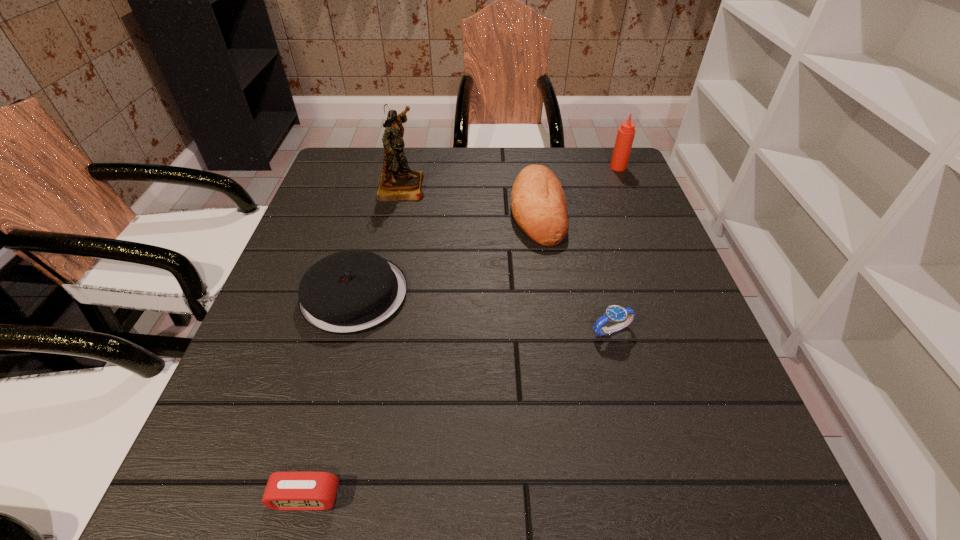
Choose which object is the second nearest neighbor to the tallest object. Please provide its 2D coordinates. Your answer should be formatted as a tuple, i.e. [(x, y)], where the tuple contains the x and y coordinates of a point satisfying the conditions above.

[(539, 207)]

Identify the location of vacant area that satisfies the following two spatial constraints: 1. on the front-facing side of the tallest object; 2. on the left side of the bread. (396, 211).

At what (x,y) coordinates should I click in order to perform the action: click on vacant area that satisfies the following two spatial constraints: 1. on the front-facing side of the bread; 2. on the right side of the figurine. Please return your answer as a coordinate pair (x, y). The height and width of the screenshot is (540, 960). Looking at the image, I should click on (396, 211).

Image resolution: width=960 pixels, height=540 pixels. What are the coordinates of `vacant space that satisfies the following two spatial constraints: 1. on the front-facing side of the bread; 2. on the right side of the figurine` in the screenshot? It's located at (396, 211).